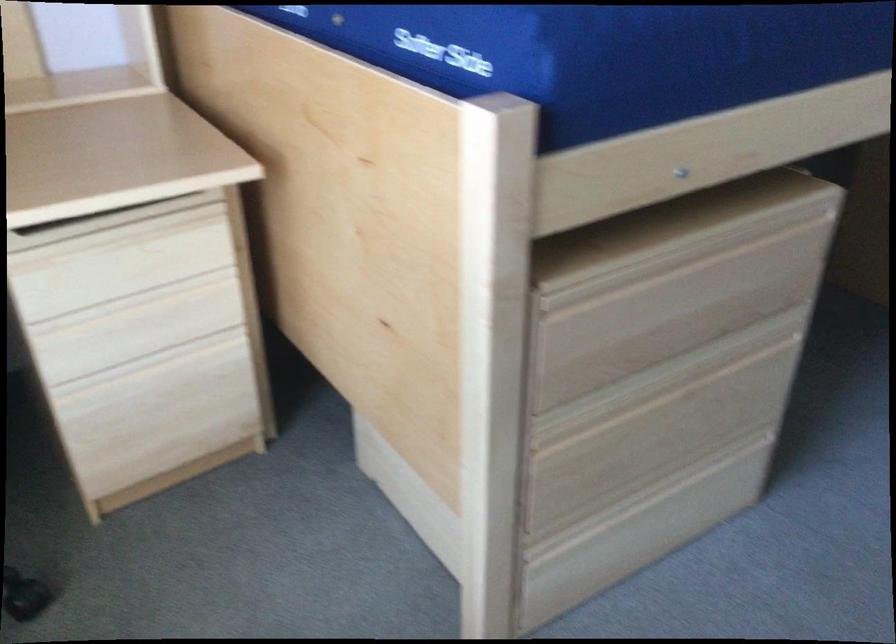
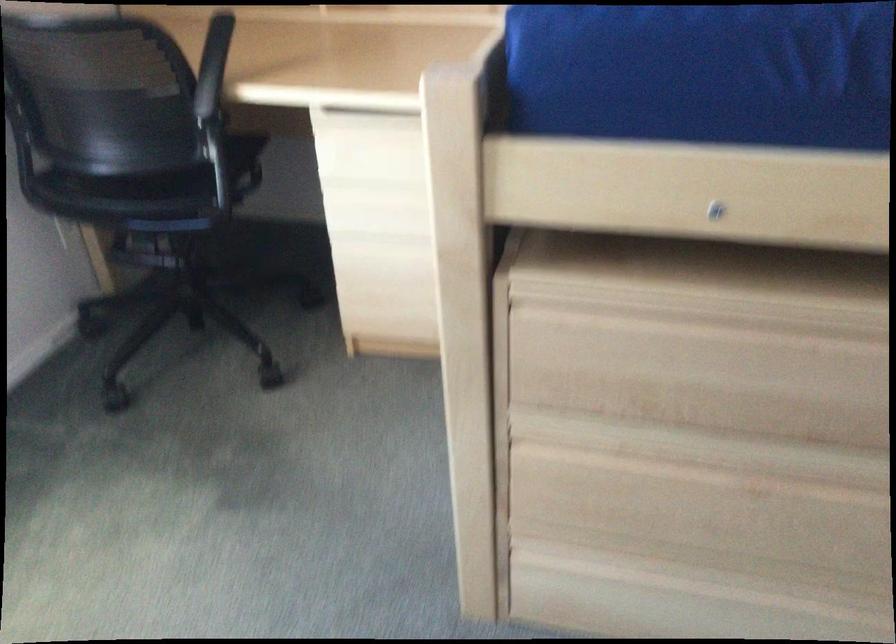
Question: The camera is either moving clockwise (left) or counter-clockwise (right) around the object. The first image is from the beginning of the video and the second image is from the end. Is the camera moving left or right when shooting the video?

Choices:
 (A) Left
 (B) Right

Answer: (B)